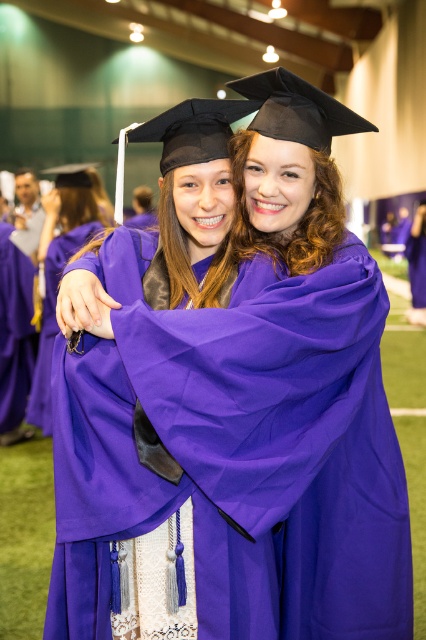
Between matte purple gown at center and purple matte graduation robe at center, which one appears on the right side from the viewer's perspective?

matte purple gown at center is more to the right.

Image resolution: width=426 pixels, height=640 pixels. Find the location of `matte purple gown at center`. matte purple gown at center is located at coordinates (58, 272).